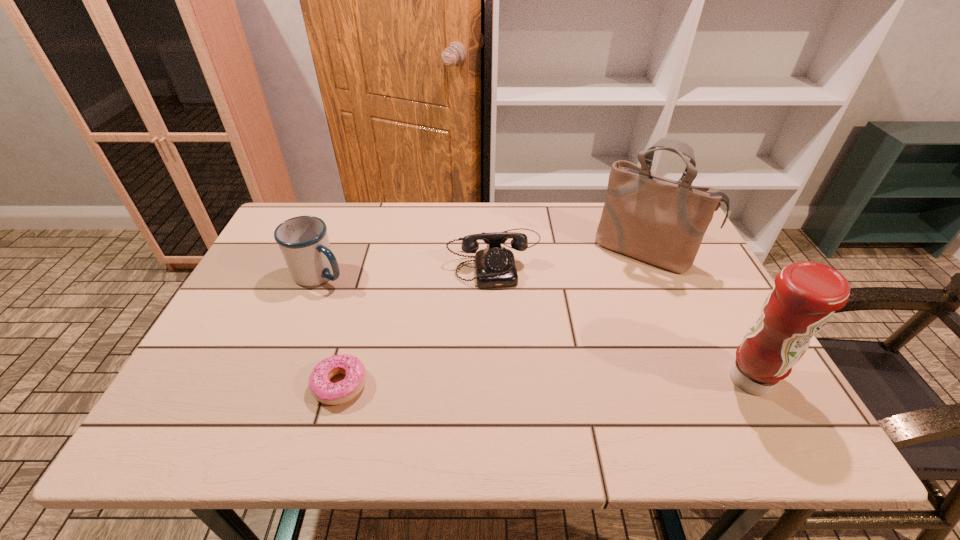
The height and width of the screenshot is (540, 960). Find the location of `free space on the desktop that is between the doughnut and the condiment and is positioned on the front-facing side of the tallest object`. free space on the desktop that is between the doughnut and the condiment and is positioned on the front-facing side of the tallest object is located at coordinates (576, 382).

At what (x,y) coordinates should I click in order to perform the action: click on free space on the desktop that is between the shortest object and the condiment and is positioned on the front-facing side of the telephone. Please return your answer as a coordinate pair (x, y). This screenshot has height=540, width=960. Looking at the image, I should click on (515, 383).

Identify the location of vacant spot on the desktop that is between the shortest object and the fourth shortest object and is positioned on the handle side of the leftmost object. Image resolution: width=960 pixels, height=540 pixels. (550, 382).